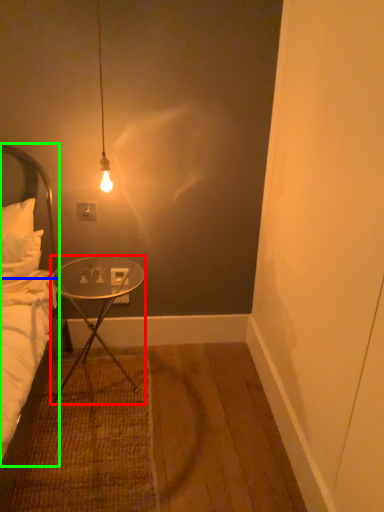
Question: Which is nearer to the desk (highlighted by a red box)? headboard (highlighted by a blue box) or bed (highlighted by a green box).

Choices:
 (A) headboard
 (B) bed

Answer: (B)